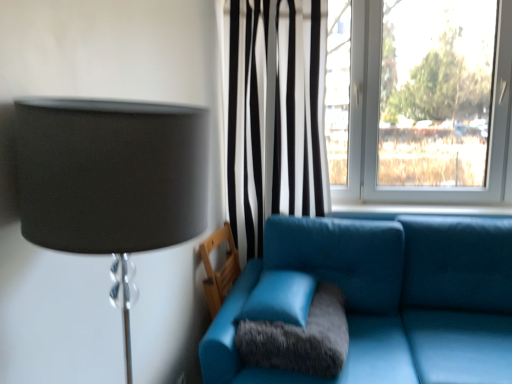
Question: Is teal leather armchair at lower center in front of or behind matte black lampshade at left in the image?

Choices:
 (A) front
 (B) behind

Answer: (B)

Question: From a real-world perspective, is teal leather armchair at lower center positioned above or below matte black lampshade at left?

Choices:
 (A) below
 (B) above

Answer: (A)

Question: Estimate the real-world distances between objects in this image. Which object is farther from the blue fabric window sill at center?

Choices:
 (A) fuzzy gray pillow at center
 (B) matte black lampshade at left
 (C) teal leather armchair at lower center
 (D) teal leather couch at center
 (E) matte leather pillow at center

Answer: (B)

Question: Considering the real-world distances, which object is closest to the fuzzy gray pillow at center?

Choices:
 (A) blue fabric window sill at center
 (B) teal leather couch at center
 (C) teal leather armchair at lower center
 (D) matte leather pillow at center
 (E) matte black lampshade at left

Answer: (D)